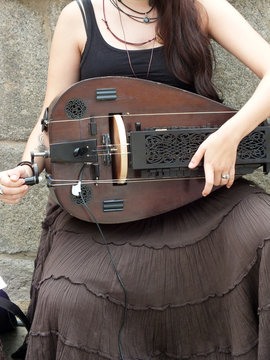
The height and width of the screenshot is (360, 270). I want to click on cord, so click(79, 188).